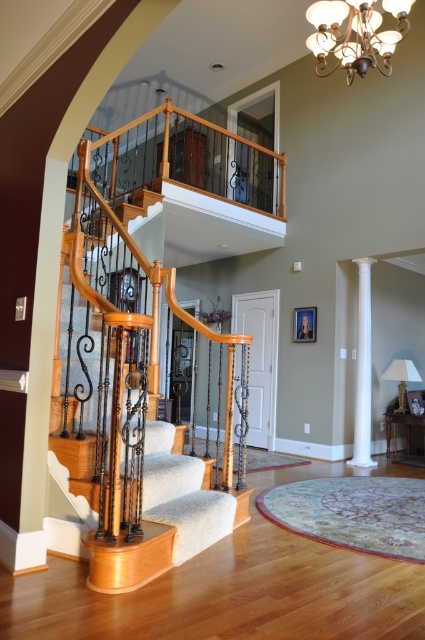
You are an interior designer assessing the space. The matte gold chandelier at upper center and the white smooth column at right are both in view. Which object is shorter in height?

The matte gold chandelier at upper center has a lesser height compared to the white smooth column at right, so the matte gold chandelier at upper center is shorter in height.

You are standing in the center of the room facing the staircase. Which object is closer to your right side, the wooden staircase with carpeted steps at left or the white smooth column at right?

The white smooth column at right is closer to your right side because it is positioned to the right of the wooden staircase with carpeted steps at left.

You are an interior designer planning to place a large sofa in the living room. The sofa is 2 meters wide. You need to know if the space between the wooden staircase with carpeted steps at left and the white smooth column at right is wide enough. Can you confirm?

The wooden staircase with carpeted steps at left is wider than the white smooth column at right, so the space between them might be sufficient for the sofa. However, without exact measurements of the distance between them, it is hard to confirm definitively.